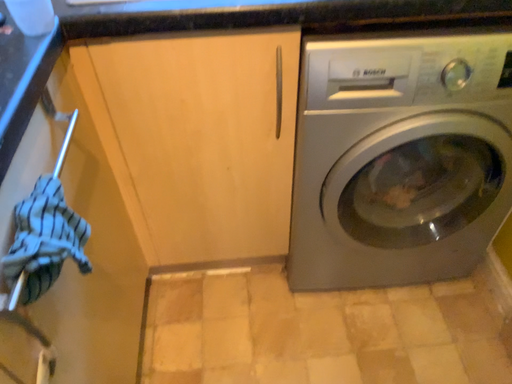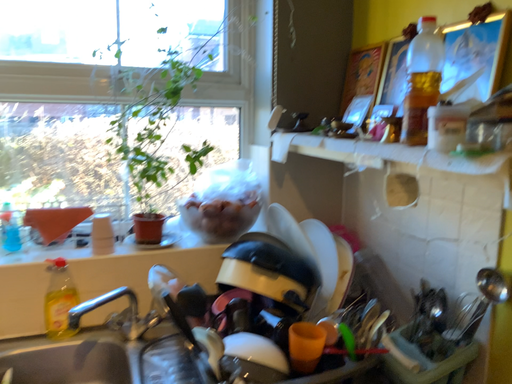
Question: How did the camera likely rotate when shooting the video?

Choices:
 (A) rotated left
 (B) rotated right

Answer: (B)